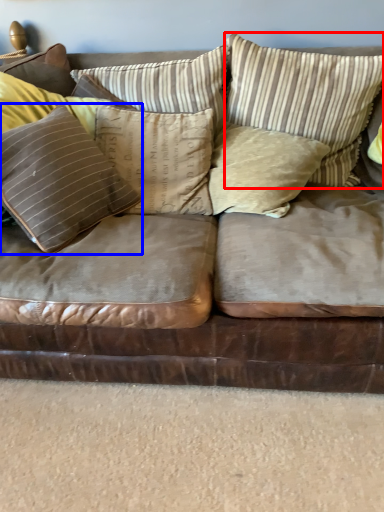
Question: Which object appears farthest to the camera in this image, pillow (highlighted by a red box) or pillow (highlighted by a blue box)?

Choices:
 (A) pillow
 (B) pillow

Answer: (A)